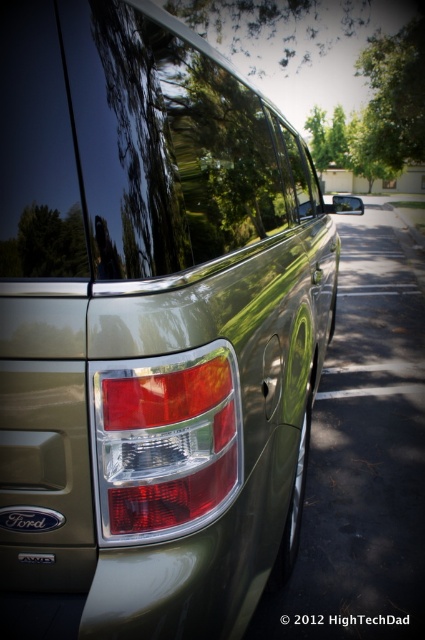
You are standing in front of a Ford vehicle parked in a driveway. You notice the matte plastic tail light at center and the green leafy tree at upper center. Which object is positioned higher in the image?

The green leafy tree at upper center is positioned higher in the image than the matte plastic tail light at center, as stated in the description that the matte plastic tail light at center is located below it.

You are standing in front of a Ford vehicle parked in a driveway. You want to locate the green leafy tree at upper center. According to the coordinates provided, where would you look on the car?

The green leafy tree at upper center is reflected at point (x=379, y=109) on the car.

You are a driver who just parked your Ford vehicle in the driveway. You want to check if the green leafy tree at upper center is blocking the view of the black plastic license plate at lower center. Based on the reflection on your car, can you confirm if the tree is obscuring the license plate?

The green leafy tree at upper center is positioned over the black plastic license plate at lower center, so yes, the tree is obscuring the license plate in the reflection.